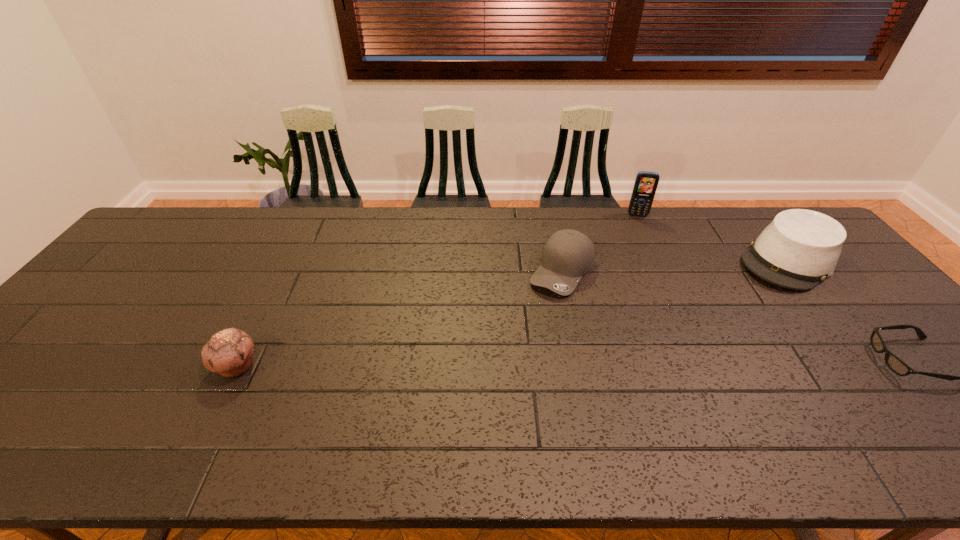
Where is `object that is at the right edge`? Image resolution: width=960 pixels, height=540 pixels. object that is at the right edge is located at coordinates (800, 248).

What are the coordinates of `object that is at the far right corner` in the screenshot? It's located at (800, 248).

I want to click on free space at the far edge of the desktop, so click(x=522, y=229).

Locate an element on the screen. vacant space at the near edge of the desktop is located at coordinates (179, 390).

The width and height of the screenshot is (960, 540). Identify the location of vacant space at the left edge. (161, 271).

You are a GUI agent. You are given a task and a screenshot of the screen. Output one action in this format:
    pyautogui.click(x=<x>, y=<y>)
    Task: Click on the free spot between the baseball cap and the cellular telephone
    
    Given the screenshot: What is the action you would take?
    pyautogui.click(x=600, y=243)

The width and height of the screenshot is (960, 540). In order to click on blank region between the second shortest object and the baseball cap in this screenshot , I will do `click(399, 318)`.

Where is `free space between the hat and the third object from left to right`? This screenshot has width=960, height=540. free space between the hat and the third object from left to right is located at coordinates coord(712,238).

You are a GUI agent. You are given a task and a screenshot of the screen. Output one action in this format:
    pyautogui.click(x=<x>, y=<y>)
    Task: Click on the free space between the tallest object and the fourth object from right to left
    
    Given the screenshot: What is the action you would take?
    pyautogui.click(x=600, y=243)

Locate an element on the screen. The width and height of the screenshot is (960, 540). free space between the second object from left to right and the muffin is located at coordinates (399, 318).